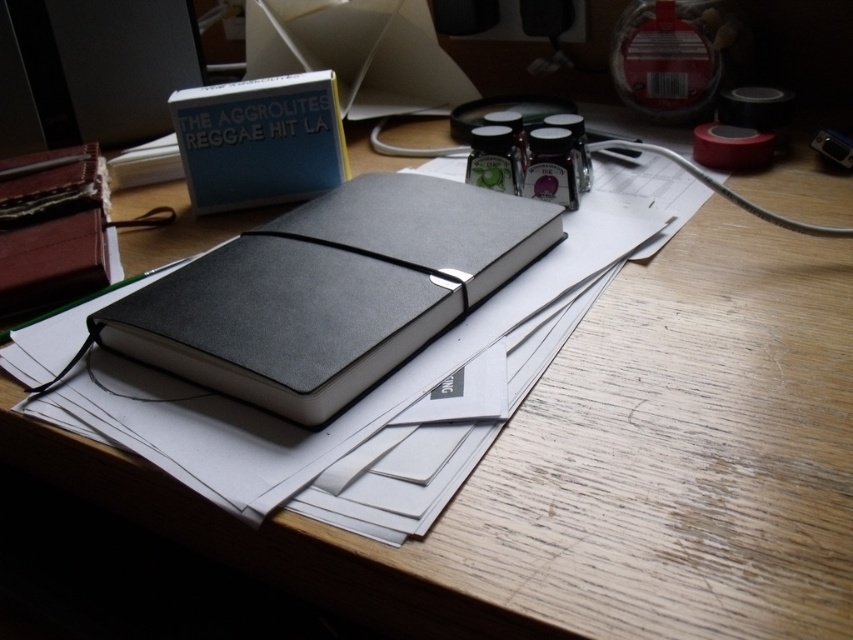
You are standing in front of the desk and want to place a small object on the desk. You have two options to choose from. The first option is to place it at point (340, 381) and the second option is to place it at point (268, 115). Which point is closer to you?

Point (340, 381) is closer to the viewer than point (268, 115).

You are organizing items on a desk and see the matte black notebook at center and the matte black notebook at upper left. Which notebook is positioned lower on the desk?

The matte black notebook at center is positioned lower than the matte black notebook at upper left.